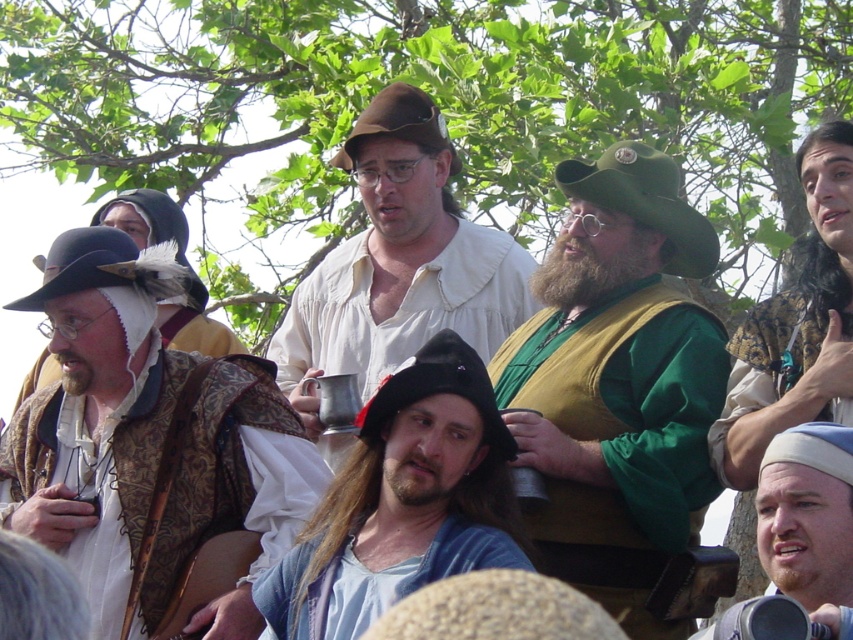
Question: Which point is farther from the camera taking this photo?

Choices:
 (A) (795, 374)
 (B) (33, 388)
 (C) (801, 534)
 (D) (71, 488)

Answer: (B)

Question: Does white cotton shirt at center have a greater width compared to matte brown vest at left?

Choices:
 (A) yes
 (B) no

Answer: (A)

Question: Is camouflage fabric vest at right below matte brown vest at left?

Choices:
 (A) no
 (B) yes

Answer: (B)

Question: Estimate the real-world distances between objects in this image. Which object is farther from the light blue fabric at center?

Choices:
 (A) camouflage fabric vest at right
 (B) green matte vest at center
 (C) blue denim shirt at center

Answer: (A)

Question: Which point is closer to the camera taking this photo?

Choices:
 (A) (194, 340)
 (B) (79, 433)
 (C) (466, 557)
 (D) (805, 296)

Answer: (C)

Question: Does white cotton shirt at center appear on the right side of beige fabric headband at lower right?

Choices:
 (A) yes
 (B) no

Answer: (B)